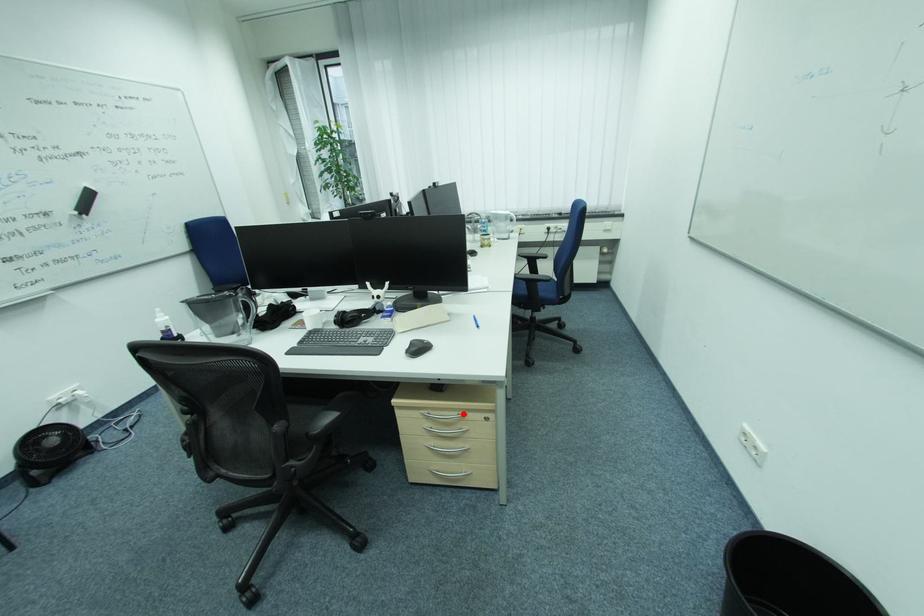
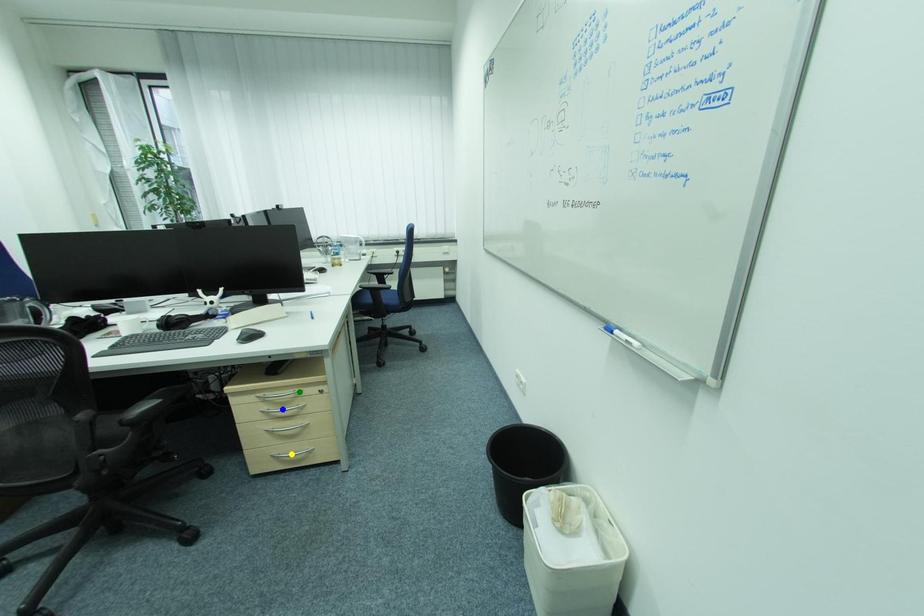
Question: I am providing you with two images of the same scene from different viewpoints. A red point is marked on the first image. You are given multiple points on the second image. In image 2, which mark is for the same physical point as the one in image 1?

Choices:
 (A) blue point
 (B) green point
 (C) yellow point

Answer: (B)